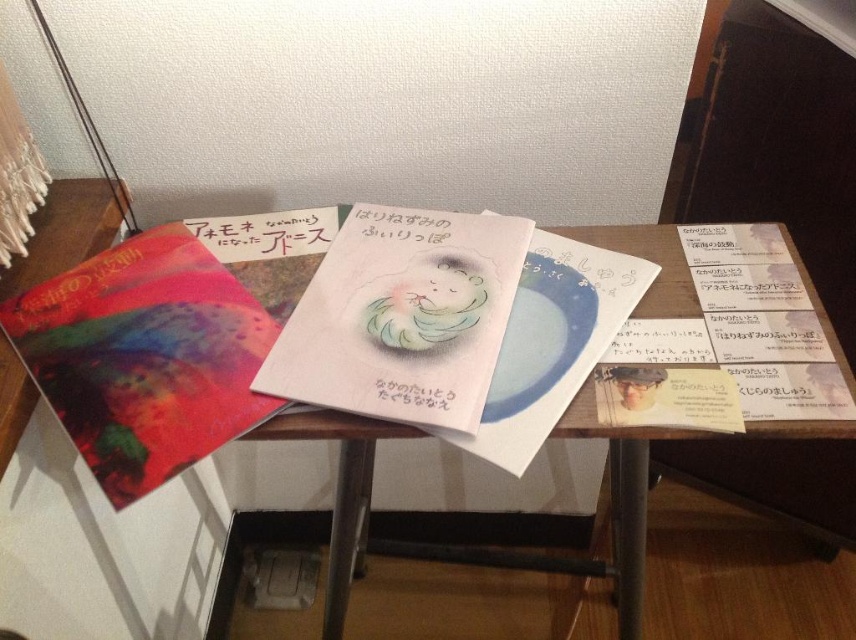
Between pastel watercolor cat at center and black paper at center, which one appears on the right side from the viewer's perspective?

From the viewer's perspective, pastel watercolor cat at center appears more on the right side.

Is pastel watercolor cat at center bigger than black paper at center?

Indeed, pastel watercolor cat at center has a larger size compared to black paper at center.

Locate an element on the screen. Image resolution: width=856 pixels, height=640 pixels. pastel watercolor cat at center is located at coordinates (426, 301).

Does shiny metallic postcard at left come in front of white paper at center?

Yes, shiny metallic postcard at left is closer to the viewer.

Who is more distant from viewer, [183,332] or [360,212]?

The point [360,212] is behind.

Locate an element on the screen. shiny metallic postcard at left is located at coordinates (146, 356).

Can you confirm if shiny metallic postcard at left is positioned below pastel watercolor cat at center?

Indeed, shiny metallic postcard at left is positioned under pastel watercolor cat at center.

Does point (34, 288) come in front of point (425, 340)?

No.

Does point (93, 273) lie behind point (413, 316)?

That is True.

Identify the location of shiny metallic postcard at left. The width and height of the screenshot is (856, 640). (146, 356).